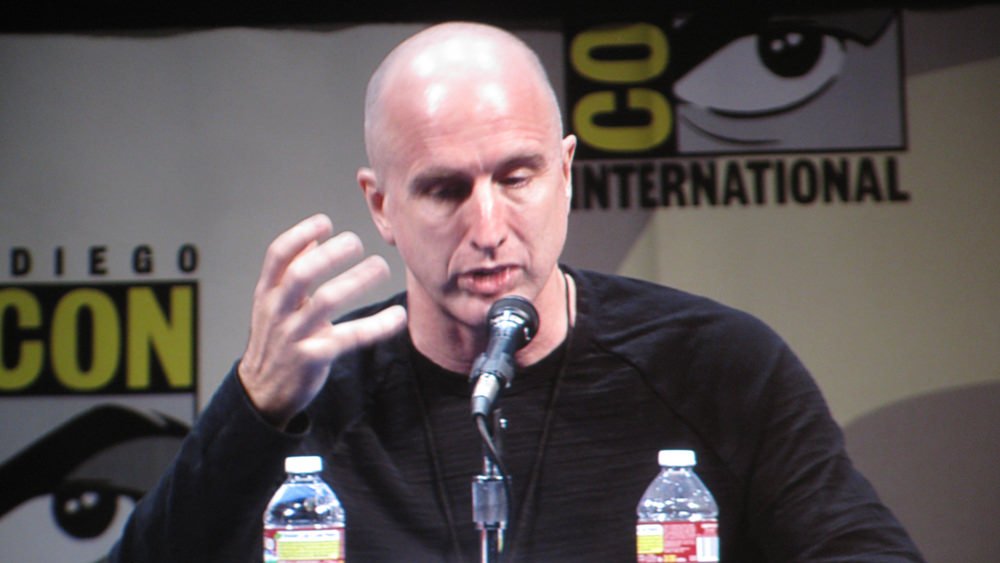
At what (x,y) coordinates should I click in order to perform the action: click on bottle lid. Please return your answer as a coordinate pair (x, y). Looking at the image, I should click on (315, 467), (676, 463).